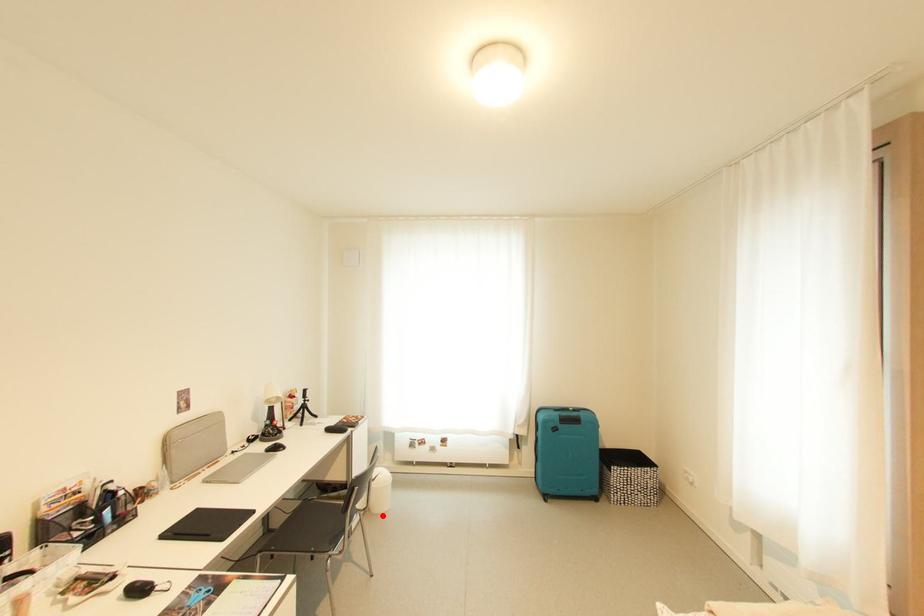
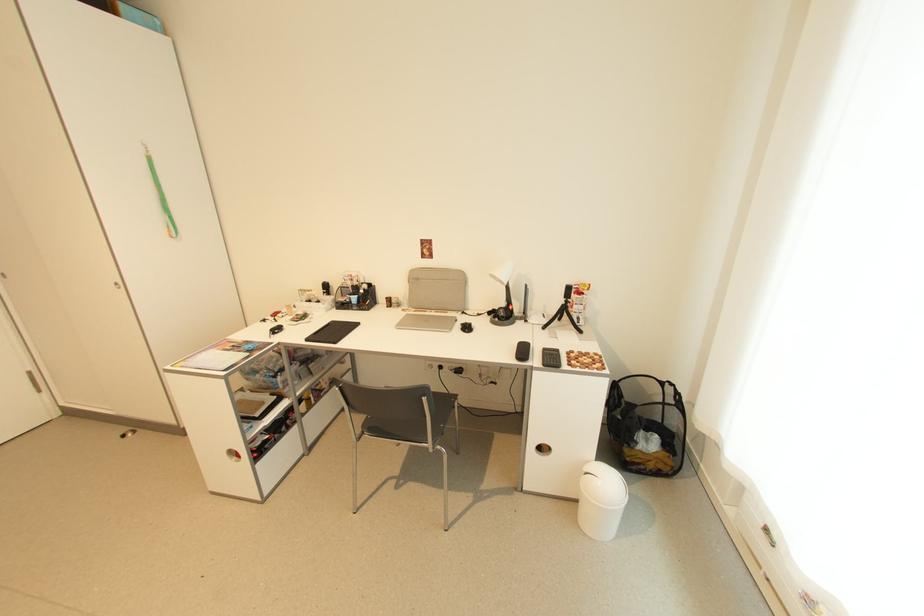
Question: I am providing you with two images of the same scene from different viewpoints. Image1 has a red point marked. In image2, the corresponding 3D location appears at what relative position? Reply with the corresponding letter.

Choices:
 (A) Closer
 (B) Farther

Answer: (A)